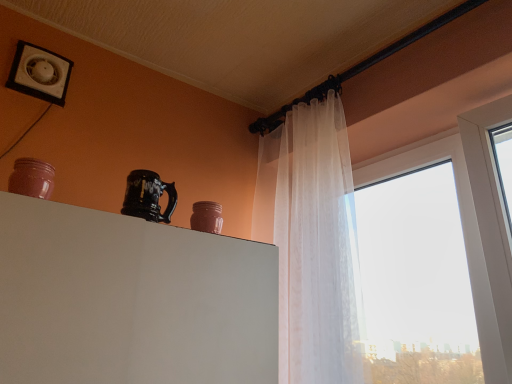
Question: Considering the relative positions of matte pink jar at left, which ranks as the second pottery in back-to-front order, and matte pink jar at upper center, the first pottery from the right, in the image provided, is matte pink jar at left, which ranks as the second pottery in back-to-front order, to the right of matte pink jar at upper center, the first pottery from the right, from the viewer's perspective?

Choices:
 (A) no
 (B) yes

Answer: (A)

Question: Considering the relative positions of matte pink jar at left, positioned as the second pottery in right-to-left order, and matte pink jar at upper center, the first pottery positioned from the bottom, in the image provided, is matte pink jar at left, positioned as the second pottery in right-to-left order, to the left of matte pink jar at upper center, the first pottery positioned from the bottom, from the viewer's perspective?

Choices:
 (A) no
 (B) yes

Answer: (B)

Question: Is matte pink jar at upper center, which is the 2th pottery in left-to-right order, a part of matte pink jar at left, the first pottery viewed from the top?

Choices:
 (A) yes
 (B) no

Answer: (B)

Question: Is matte pink jar at left, positioned as the second pottery in right-to-left order, oriented towards matte pink jar at upper center, positioned as the second pottery in front-to-back order?

Choices:
 (A) no
 (B) yes

Answer: (A)

Question: Does matte pink jar at left, which is the 2th pottery in bottom-to-top order, have a lesser height compared to matte pink jar at upper center, the first pottery from the right?

Choices:
 (A) yes
 (B) no

Answer: (B)

Question: From the image's perspective, is matte pink jar at left, which ranks as the second pottery in back-to-front order, below matte pink jar at upper center, which appears as the first pottery when viewed from the back?

Choices:
 (A) no
 (B) yes

Answer: (A)

Question: From the image's perspective, would you say glossy ceramic mug at upper center is positioned over matte pink jar at upper center, the first pottery from the right?

Choices:
 (A) yes
 (B) no

Answer: (A)

Question: Can you confirm if glossy ceramic mug at upper center is shorter than matte pink jar at upper center, positioned as the second pottery in front-to-back order?

Choices:
 (A) yes
 (B) no

Answer: (B)

Question: From a real-world perspective, is glossy ceramic mug at upper center below matte pink jar at upper center, positioned as the second pottery in front-to-back order?

Choices:
 (A) yes
 (B) no

Answer: (B)

Question: Is glossy ceramic mug at upper center smaller than matte pink jar at upper center, the first pottery from the right?

Choices:
 (A) no
 (B) yes

Answer: (A)

Question: Is glossy ceramic mug at upper center not within matte pink jar at upper center, positioned as the second pottery in front-to-back order?

Choices:
 (A) yes
 (B) no

Answer: (A)

Question: Considering the relative sizes of glossy ceramic mug at upper center and matte pink jar at upper center, which appears as the first pottery when viewed from the back, in the image provided, is glossy ceramic mug at upper center taller than matte pink jar at upper center, which appears as the first pottery when viewed from the back,?

Choices:
 (A) no
 (B) yes

Answer: (B)

Question: From the image's perspective, is matte pink jar at upper center, the 2th pottery viewed from the top, located beneath glossy ceramic mug at upper center?

Choices:
 (A) yes
 (B) no

Answer: (A)